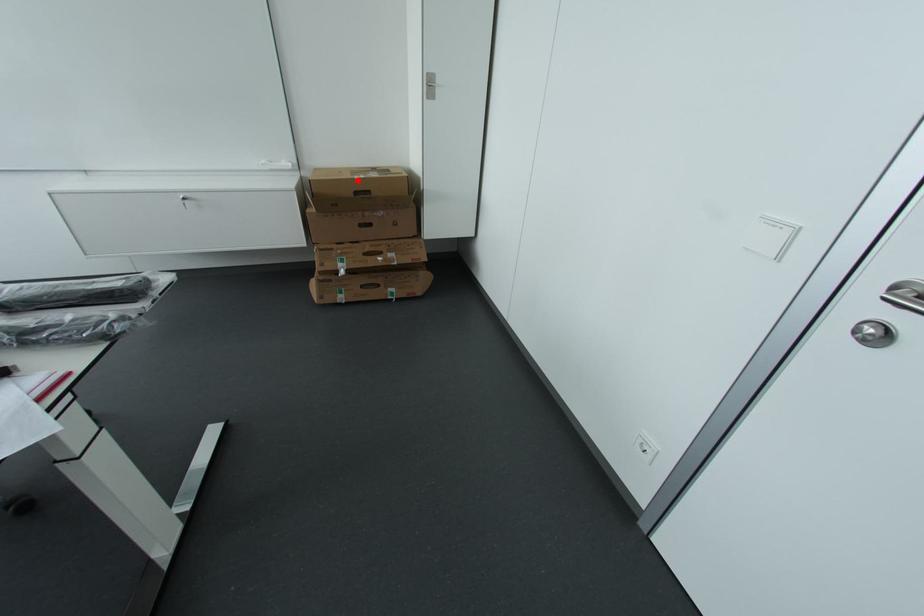
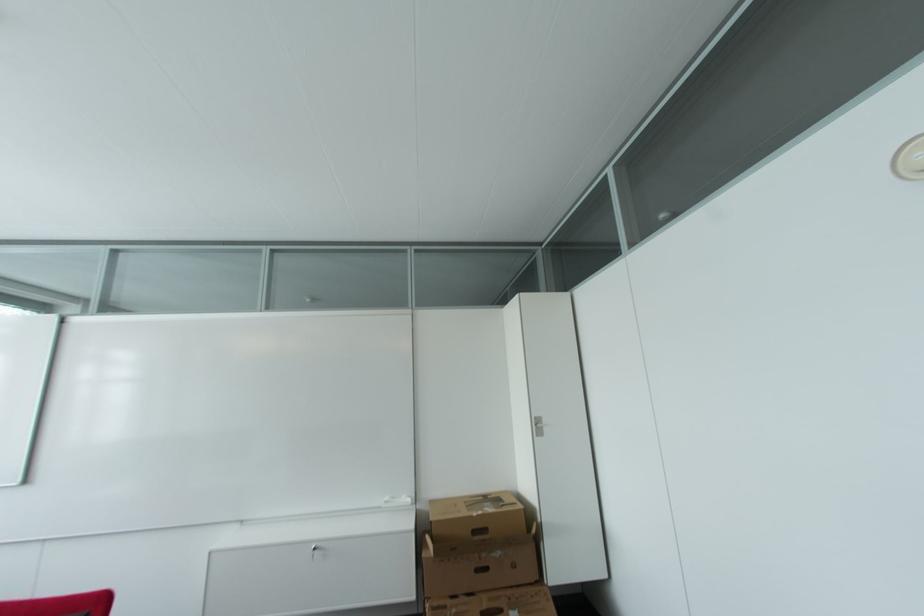
Question: I am providing you with two images of the same scene from different viewpoints. In image1, a red point is highlighted. Considering the same 3D point in image2, which of the following is correct?

Choices:
 (A) It is closer
 (B) It is farther

Answer: (B)